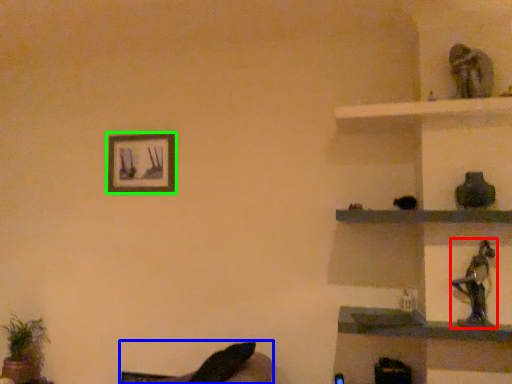
Question: Based on their relative distances, which object is farther from toy (highlighted by a red box)? Choose from swivel chair (highlighted by a blue box) and picture frame (highlighted by a green box).

Choices:
 (A) swivel chair
 (B) picture frame

Answer: (B)